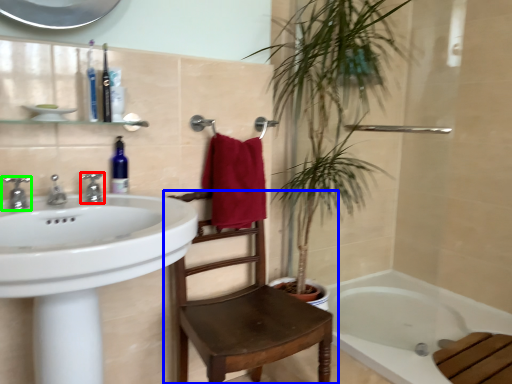
Question: Based on their relative distances, which object is farther from tap (highlighted by a red box)? Choose from chair (highlighted by a blue box) and tap (highlighted by a green box).

Choices:
 (A) chair
 (B) tap

Answer: (A)